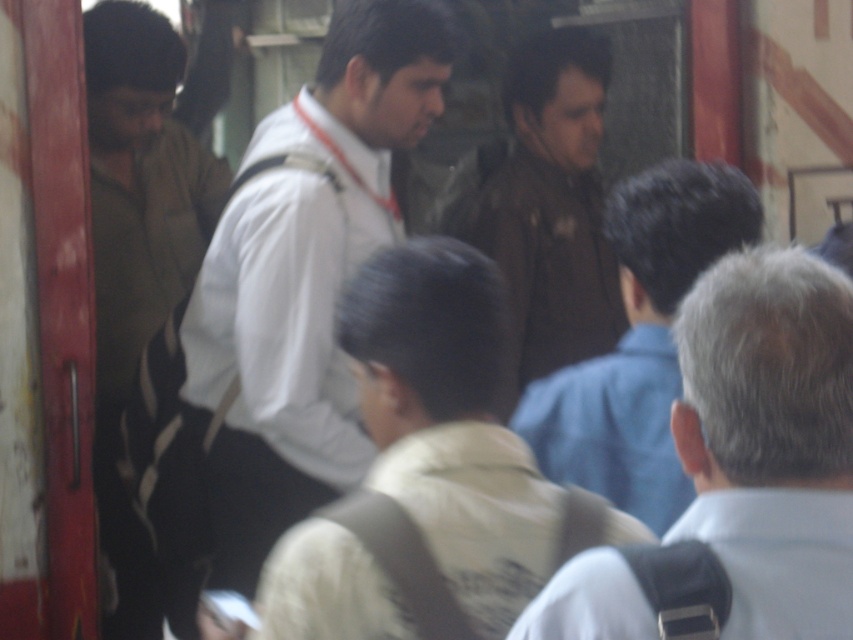
Question: Which point is farther to the camera?

Choices:
 (A) brown cotton shirt at left
 (B) white shirt at center

Answer: (A)

Question: Does beige fabric vest at center have a larger size compared to brown leather jacket at upper center?

Choices:
 (A) yes
 (B) no

Answer: (A)

Question: Which is nearer to the brown cotton shirt at left?

Choices:
 (A) white shirt at center
 (B) gray fabric shirt at upper right
 (C) beige fabric vest at center
 (D) brown leather jacket at upper center

Answer: (A)

Question: Can you confirm if white shirt at center is bigger than brown cotton shirt at left?

Choices:
 (A) yes
 (B) no

Answer: (B)

Question: Which object appears closest to the camera in this image?

Choices:
 (A) dark brown leather jacket at center
 (B) beige fabric vest at center
 (C) white shirt at center
 (D) brown leather jacket at upper center

Answer: (B)

Question: Can you confirm if beige fabric vest at center is bigger than brown cotton shirt at left?

Choices:
 (A) no
 (B) yes

Answer: (A)